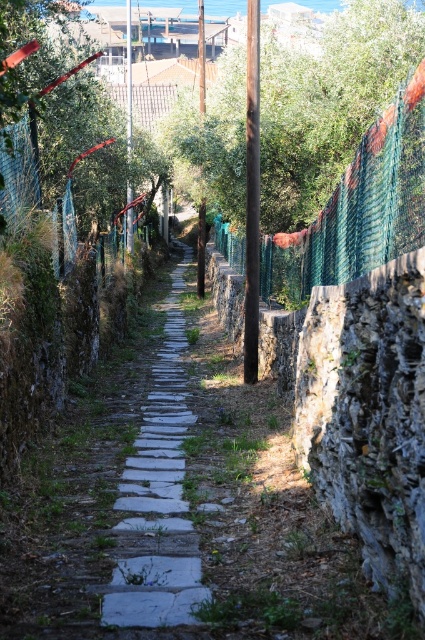
Question: Does green mesh fence at center have a lesser width compared to white stone path at center?

Choices:
 (A) yes
 (B) no

Answer: (B)

Question: Among these objects, which one is nearest to the camera?

Choices:
 (A) white stone path at center
 (B) green mesh fence at center

Answer: (A)

Question: Can you confirm if green mesh fence at center is smaller than white stone path at center?

Choices:
 (A) yes
 (B) no

Answer: (B)

Question: Can you confirm if green mesh fence at center is positioned to the left of white stone path at center?

Choices:
 (A) no
 (B) yes

Answer: (A)

Question: Which of the following is the farthest from the observer?

Choices:
 (A) (175, 284)
 (B) (348, 234)

Answer: (A)